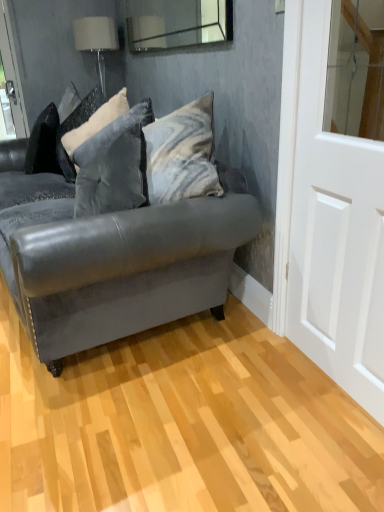
Question: Is point (148, 111) closer or farther from the camera than point (223, 40)?

Choices:
 (A) closer
 (B) farther

Answer: (B)

Question: Based on their sizes in the image, would you say velvet gray pillow at center, placed as the first pillow when sorted from front to back, is bigger or smaller than clear glass mirror at upper center?

Choices:
 (A) big
 (B) small

Answer: (A)

Question: Which is nearer to the white fabric lampshade at upper left?

Choices:
 (A) velvet gray pillow at upper left, positioned as the second pillow in front-to-back order
 (B) velvet gray pillow at center, placed as the first pillow when sorted from front to back
 (C) matte gray leather couch at center
 (D) clear glass mirror at upper center
 (E) white glossy door at right

Answer: (D)

Question: Based on their relative distances, which object is farther from the velvet gray pillow at upper left, positioned as the second pillow in front-to-back order?

Choices:
 (A) velvet gray pillow at center, placed as the first pillow when sorted from front to back
 (B) clear glass mirror at upper center
 (C) white glossy door at right
 (D) matte gray leather couch at center
 (E) white fabric lampshade at upper left

Answer: (C)